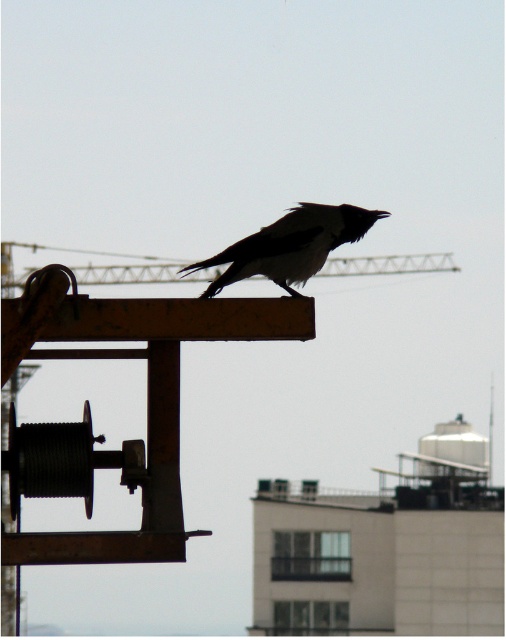
Is point (190, 266) closer to viewer compared to point (392, 273)?

Yes, point (190, 266) is in front of point (392, 273).

Who is more distant from viewer, (292, 268) or (155, 262)?

Positioned behind is point (155, 262).

You are a GUI agent. You are given a task and a screenshot of the screen. Output one action in this format:
    pyautogui.click(x=<x>, y=<y>)
    Task: Click on the black matte bird at center
    Image resolution: width=506 pixels, height=640 pixels.
    Given the screenshot: What is the action you would take?
    pyautogui.click(x=289, y=244)